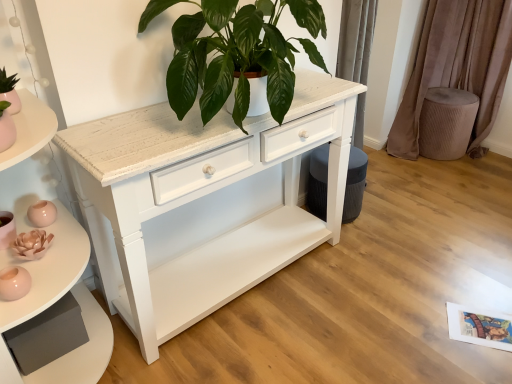
Question: Does velvet taupe curtain at right come behind white wood chest of drawers at center?

Choices:
 (A) no
 (B) yes

Answer: (B)

Question: Does velvet taupe curtain at right come in front of white wood chest of drawers at center?

Choices:
 (A) yes
 (B) no

Answer: (B)

Question: From the image's perspective, does velvet taupe curtain at right appear lower than white wood chest of drawers at center?

Choices:
 (A) no
 (B) yes

Answer: (A)

Question: Is velvet taupe curtain at right not close to white wood chest of drawers at center?

Choices:
 (A) no
 (B) yes

Answer: (B)

Question: Is velvet taupe curtain at right completely or partially outside of white wood chest of drawers at center?

Choices:
 (A) yes
 (B) no

Answer: (A)

Question: In terms of height, does velvet taupe stool at right look taller or shorter compared to velvet taupe curtain at right?

Choices:
 (A) short
 (B) tall

Answer: (A)

Question: Is velvet taupe stool at right inside the boundaries of velvet taupe curtain at right, or outside?

Choices:
 (A) inside
 (B) outside

Answer: (B)

Question: From the image's perspective, is velvet taupe stool at right positioned above or below velvet taupe curtain at right?

Choices:
 (A) above
 (B) below

Answer: (B)

Question: In the image, is velvet taupe stool at right positioned in front of or behind velvet taupe curtain at right?

Choices:
 (A) front
 (B) behind

Answer: (B)

Question: Is point (25, 266) positioned closer to the camera than point (248, 69)?

Choices:
 (A) closer
 (B) farther

Answer: (A)

Question: Choose the correct answer: Is white painted wood shelf at left inside green matte plant at center or outside it?

Choices:
 (A) inside
 (B) outside

Answer: (B)

Question: Considering the positions of white painted wood shelf at left and green matte plant at center in the image, is white painted wood shelf at left bigger or smaller than green matte plant at center?

Choices:
 (A) small
 (B) big

Answer: (B)

Question: From the image's perspective, is white painted wood shelf at left above or below green matte plant at center?

Choices:
 (A) above
 (B) below

Answer: (B)

Question: In terms of size, does white painted wood shelf at left appear bigger or smaller than velvet taupe stool at right?

Choices:
 (A) small
 (B) big

Answer: (B)

Question: Is white painted wood shelf at left inside or outside of velvet taupe stool at right?

Choices:
 (A) outside
 (B) inside

Answer: (A)